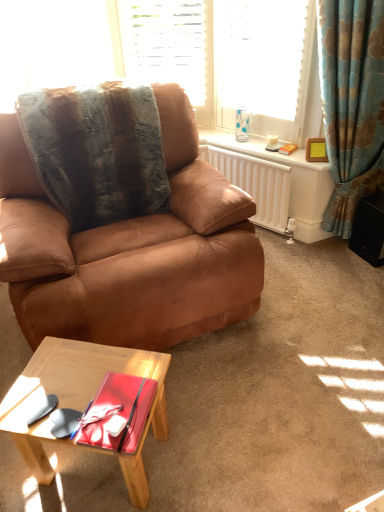
In order to click on free region under light wood coffee table at lower left (from a real-world perspective) in this screenshot , I will do pos(105,466).